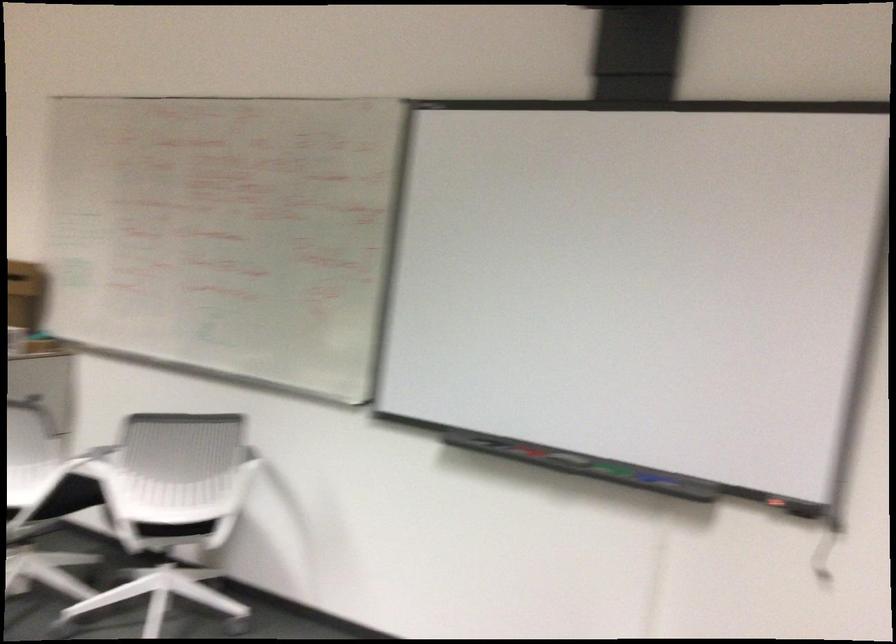
At what (x,y) coordinates should I click in order to perform the action: click on chair sitting surface. Please return your answer as a coordinate pair (x, y). The height and width of the screenshot is (644, 896). Looking at the image, I should click on (175, 529).